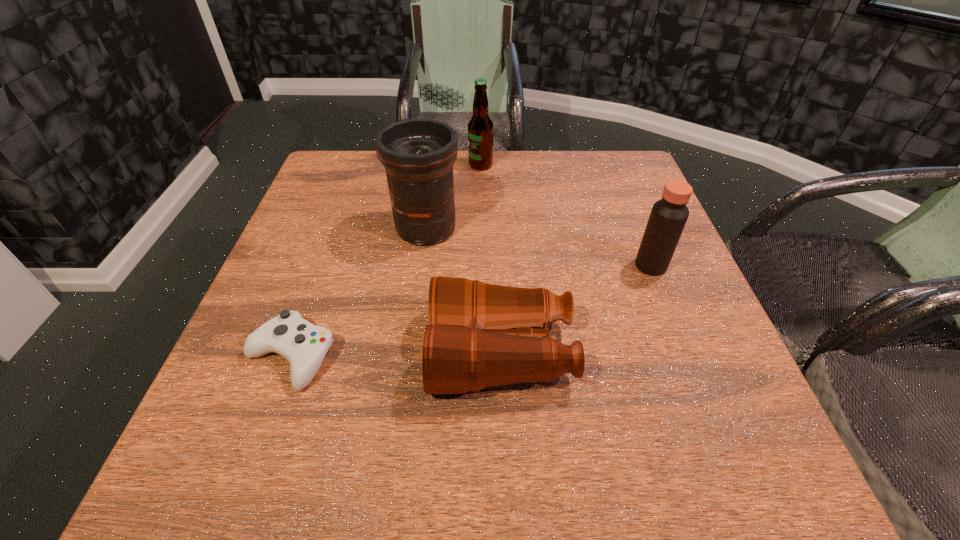
Find the location of a particular element. free space between the third shortest object and the second shortest object is located at coordinates (576, 309).

You are a GUI agent. You are given a task and a screenshot of the screen. Output one action in this format:
    pyautogui.click(x=<x>, y=<y>)
    Task: Click on the vacant area that lies between the second farthest object and the control
    Image resolution: width=960 pixels, height=540 pixels.
    Given the screenshot: What is the action you would take?
    pyautogui.click(x=358, y=293)

In order to click on free spot between the vinegar and the second farthest object in this screenshot , I will do `click(539, 247)`.

I want to click on object that stands as the closest to the second farthest object, so click(480, 335).

Choose which object is the fourth nearest neighbor to the vinegar. Please provide its 2D coordinates. Your answer should be formatted as a tuple, i.e. [(x, y)], where the tuple contains the x and y coordinates of a point satisfying the conditions above.

[(304, 345)]

Where is `vacant space that satisfies the following two spatial constraints: 1. on the label of the beer bottle; 2. on the back side of the third nearest object`? This screenshot has height=540, width=960. vacant space that satisfies the following two spatial constraints: 1. on the label of the beer bottle; 2. on the back side of the third nearest object is located at coordinates (481, 266).

You are a GUI agent. You are given a task and a screenshot of the screen. Output one action in this format:
    pyautogui.click(x=<x>, y=<y>)
    Task: Click on the vacant space that satisfies the following two spatial constraints: 1. on the back side of the telephoto lens; 2. on the right side of the shortest object
    This screenshot has width=960, height=540.
    Given the screenshot: What is the action you would take?
    pyautogui.click(x=338, y=228)

The width and height of the screenshot is (960, 540). Identify the location of vacant area in the image that satisfies the following two spatial constraints: 1. on the back side of the leftmost object; 2. on the right side of the rightmost object. (324, 266).